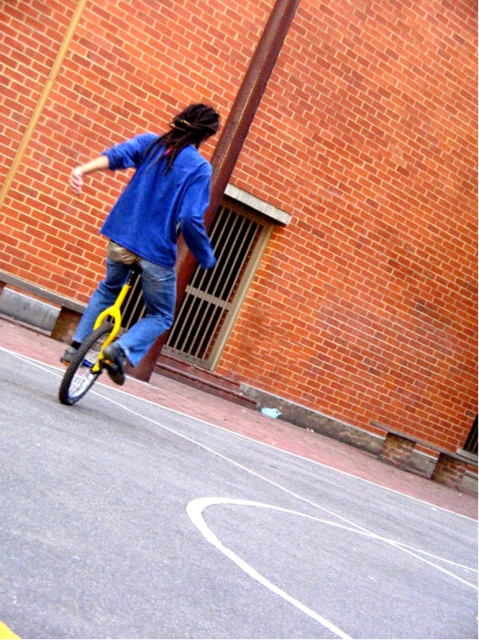
Looking at this image, which is more to the left, blue denim jacket at center or yellow matte bicycle at lower left?

From the viewer's perspective, yellow matte bicycle at lower left appears more on the left side.

This screenshot has height=640, width=479. Describe the element at coordinates (150, 227) in the screenshot. I see `blue denim jacket at center` at that location.

Between point (70, 353) and point (132, 266), which one is positioned behind?

The point (70, 353) is behind.

Where is `blue denim jacket at center`? The width and height of the screenshot is (479, 640). blue denim jacket at center is located at coordinates (150, 227).